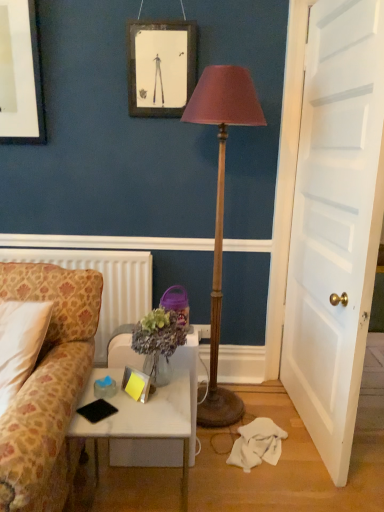
Find the location of a particular element. free space in front of white wooden door at right is located at coordinates (304, 483).